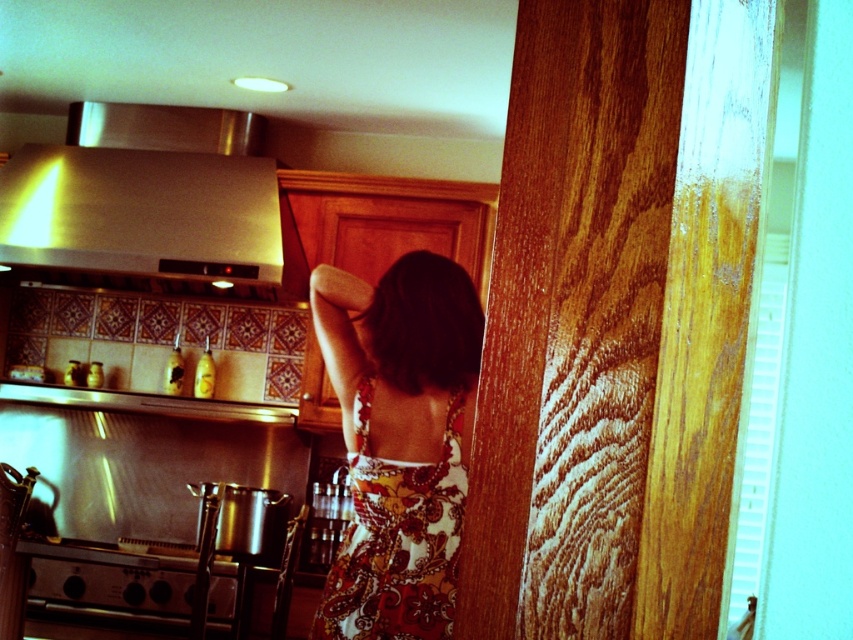
You are standing in the kitchen and want to reach both the stainless steel exhaust hood at upper left and the stainless steel oven at lower left. Which one will you need to step closer to in order to touch it?

You will need to step closer to the stainless steel oven at lower left because the stainless steel exhaust hood at upper left is closer to you already, while the oven is further away.